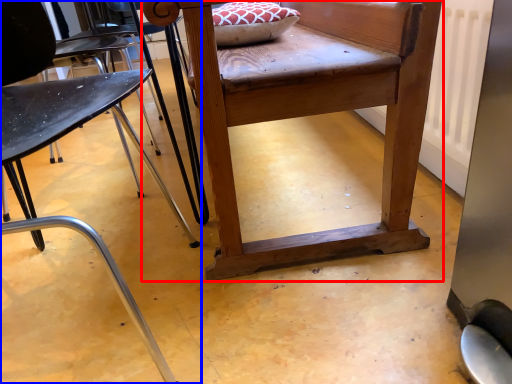
Question: Among these objects, which one is nearest to the camera, table (highlighted by a red box) or chair (highlighted by a blue box)?

Choices:
 (A) table
 (B) chair

Answer: (B)